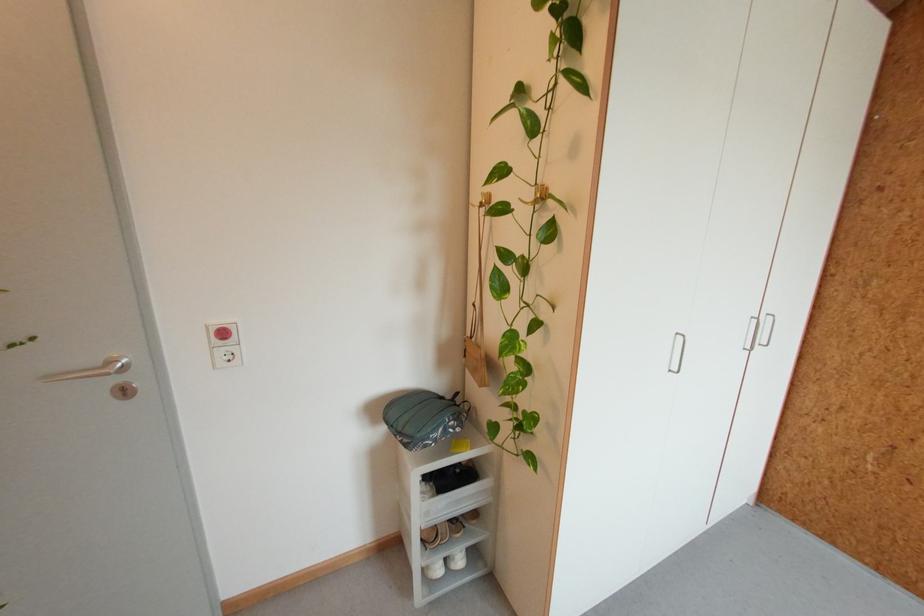
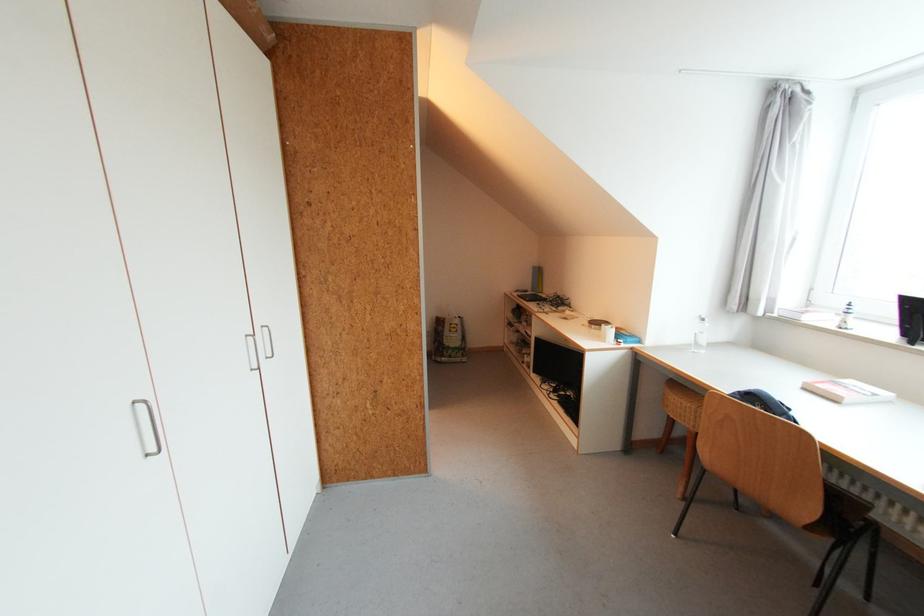
The point at (x=772, y=315) is marked in the first image. Where is the corresponding point in the second image?

(268, 326)